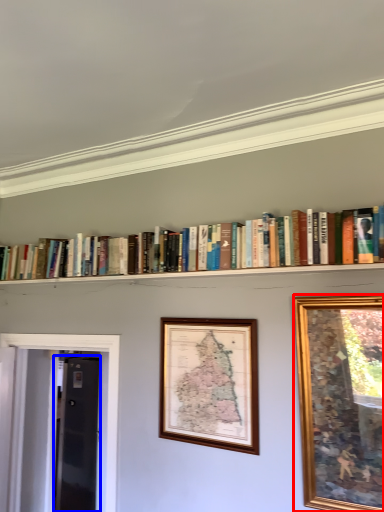
Question: Which of the following is the farthest to the observer, picture frame (highlighted by a red box) or glass door (highlighted by a blue box)?

Choices:
 (A) picture frame
 (B) glass door

Answer: (B)